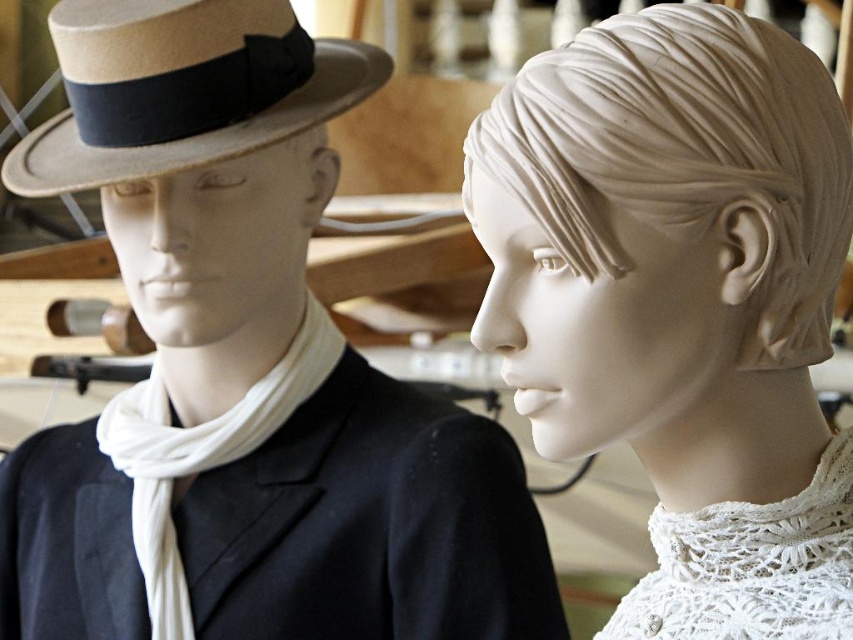
Question: Can you confirm if matte black hat at left is smaller than white marble head at center?

Choices:
 (A) yes
 (B) no

Answer: (B)

Question: Which point is closer to the camera?

Choices:
 (A) white marble head at center
 (B) beige felt fedora at left
 (C) matte black hat at left

Answer: (A)

Question: Is matte black hat at left bigger than white cotton scarf at left?

Choices:
 (A) yes
 (B) no

Answer: (A)

Question: Which of these objects is positioned closest to the white marble head at center?

Choices:
 (A) matte black hat at left
 (B) beige felt fedora at left

Answer: (A)

Question: Considering the real-world distances, which object is closest to the beige felt fedora at left?

Choices:
 (A) white marble head at center
 (B) white cotton scarf at left
 (C) matte black hat at left

Answer: (C)

Question: Can you confirm if beige felt fedora at left is smaller than white cotton scarf at left?

Choices:
 (A) no
 (B) yes

Answer: (A)